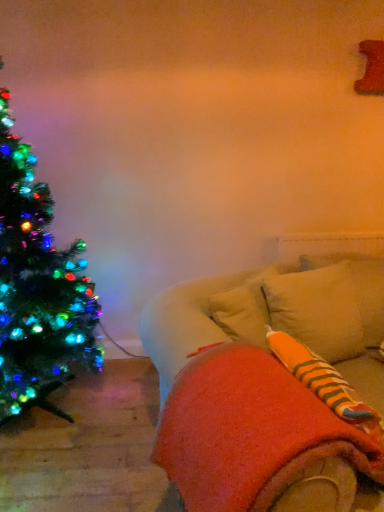
What do you see at coordinates (264, 386) in the screenshot? The image size is (384, 512). I see `orange fleece blanket at lower right` at bounding box center [264, 386].

Identify the location of orange fleece blanket at lower right. The height and width of the screenshot is (512, 384). (x=264, y=386).

Measure the distance between orange fleece blanket at lower right and camera.

orange fleece blanket at lower right is 35.68 inches from camera.

You are a GUI agent. You are given a task and a screenshot of the screen. Output one action in this format:
    pyautogui.click(x=<x>, y=<y>)
    Task: Click on the orange fleece blanket at lower right
    
    Given the screenshot: What is the action you would take?
    pyautogui.click(x=264, y=386)